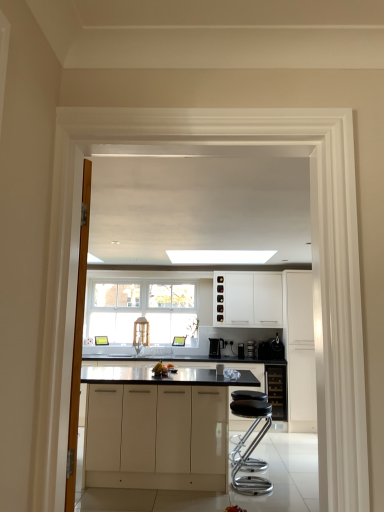
The height and width of the screenshot is (512, 384). Describe the element at coordinates (277, 390) in the screenshot. I see `black glass wine cabinet at center, which is counted as the 3th cabinetry, starting from the left` at that location.

This screenshot has width=384, height=512. What are the coordinates of `metallic silver coffee machine at center, the second appliance in the right-to-left sequence` in the screenshot? It's located at (265, 350).

Image resolution: width=384 pixels, height=512 pixels. Find the location of `white matte cabinet at center, marked as the 2th cabinetry in a left-to-right arrangement`. white matte cabinet at center, marked as the 2th cabinetry in a left-to-right arrangement is located at coordinates (247, 298).

The height and width of the screenshot is (512, 384). In order to click on black leather stool at lower center in this screenshot , I will do `click(250, 448)`.

How much space does white matte cabinetry at center, which is the 4th cabinetry from back to front, occupy vertically?

white matte cabinetry at center, which is the 4th cabinetry from back to front, is 36.18 inches in height.

Identify the location of black glass wine cabinet at center, the second cabinetry in the back-to-front sequence. (277, 390).

Between white matte cabinet at center, arranged as the third cabinetry when viewed from the right, and satin silver toaster at center, placed as the third appliance when sorted from right to left, which one appears on the left side from the viewer's perspective?

Positioned to the left is white matte cabinet at center, arranged as the third cabinetry when viewed from the right.

From a real-world perspective, is white matte cabinet at center, the fourth cabinetry positioned from the front, on top of satin silver toaster at center, placed as the third appliance when sorted from right to left?

Yes, from a real-world perspective, white matte cabinet at center, the fourth cabinetry positioned from the front, is on top of satin silver toaster at center, placed as the third appliance when sorted from right to left.

Which object is thinner, white matte cabinet at center, arranged as the third cabinetry when viewed from the right, or satin silver toaster at center, arranged as the 1th appliance when viewed from the left?

satin silver toaster at center, arranged as the 1th appliance when viewed from the left, is thinner.

Can you confirm if white matte cabinet at center, arranged as the third cabinetry when viewed from the right, is taller than satin silver toaster at center, arranged as the 1th appliance when viewed from the left?

Yes, white matte cabinet at center, arranged as the third cabinetry when viewed from the right, is taller than satin silver toaster at center, arranged as the 1th appliance when viewed from the left.

How much distance is there between satin silver toaster at center, arranged as the 1th appliance when viewed from the left, and white matte cabinetry at center, which is the 4th cabinetry from back to front?

satin silver toaster at center, arranged as the 1th appliance when viewed from the left, and white matte cabinetry at center, which is the 4th cabinetry from back to front, are 2.32 meters apart from each other.

Is satin silver toaster at center, arranged as the 1th appliance when viewed from the left, bigger than white matte cabinetry at center, the 1th cabinetry positioned from the left?

Actually, satin silver toaster at center, arranged as the 1th appliance when viewed from the left, might be smaller than white matte cabinetry at center, the 1th cabinetry positioned from the left.

Is satin silver toaster at center, placed as the third appliance when sorted from right to left, positioned behind white matte cabinetry at center, positioned as the 1th cabinetry in front-to-back order?

Yes, it is behind white matte cabinetry at center, positioned as the 1th cabinetry in front-to-back order.

From a real-world perspective, between satin silver toaster at center, arranged as the 1th appliance when viewed from the left, and white matte cabinetry at center, which is the 4th cabinetry from back to front, who is vertically higher?

satin silver toaster at center, arranged as the 1th appliance when viewed from the left, from a real-world perspective.

Which object is thinner, black glass wine cabinet at center, the 3th cabinetry positioned from the front, or satin black coffee machine at center?

satin black coffee machine at center is thinner.

Is black glass wine cabinet at center, which is counted as the 3th cabinetry, starting from the left, oriented towards satin black coffee machine at center?

No, black glass wine cabinet at center, which is counted as the 3th cabinetry, starting from the left, is not aimed at satin black coffee machine at center.

From a real-world perspective, is black glass wine cabinet at center, which is counted as the 3th cabinetry, starting from the left, under satin black coffee machine at center?

Correct, in the physical world, black glass wine cabinet at center, which is counted as the 3th cabinetry, starting from the left, is lower than satin black coffee machine at center.

Is black glass wine cabinet at center, the second cabinetry in the back-to-front sequence, to the right of satin black coffee machine at center from the viewer's perspective?

Correct, you'll find black glass wine cabinet at center, the second cabinetry in the back-to-front sequence, to the right of satin black coffee machine at center.

Is satin black coffee machine at center facing towards black plastic coffee maker at right, which is the first appliance in right-to-left order?

No.

How many degrees apart are the facing directions of satin black coffee machine at center and black plastic coffee maker at right, which is the first appliance in right-to-left order?

satin black coffee machine at center and black plastic coffee maker at right, which is the first appliance in right-to-left order, are facing 5.08 degrees away from each other.

From a real-world perspective, is satin black coffee machine at center positioned over black plastic coffee maker at right, which is the first appliance in right-to-left order, based on gravity?

No, from a real-world perspective, satin black coffee machine at center is not on top of black plastic coffee maker at right, which is the first appliance in right-to-left order.

From the satin black coffee machine at center, count 3rd appliance to the right and point to it. Please provide its 2D coordinates.

[(276, 348)]

Is there a large distance between black glass wine cabinet at center, which is counted as the 3th cabinetry, starting from the left, and black plastic coffee maker at right, which is the first appliance in right-to-left order?

That's not correct — black glass wine cabinet at center, which is counted as the 3th cabinetry, starting from the left, is a little close to black plastic coffee maker at right, which is the first appliance in right-to-left order.

Can you tell me how much black glass wine cabinet at center, the second cabinetry in the back-to-front sequence, and black plastic coffee maker at right, marked as the third appliance in a left-to-right arrangement, differ in facing direction?

The angular difference between black glass wine cabinet at center, the second cabinetry in the back-to-front sequence, and black plastic coffee maker at right, marked as the third appliance in a left-to-right arrangement, is 2.79 degrees.

From a real-world perspective, which object stands above the other?

black plastic coffee maker at right, which is the first appliance in right-to-left order, is physically above.

Does black glass wine cabinet at center, which is counted as the 3th cabinetry, starting from the left, turn towards black plastic coffee maker at right, marked as the third appliance in a left-to-right arrangement?

No, black glass wine cabinet at center, which is counted as the 3th cabinetry, starting from the left, is not oriented towards black plastic coffee maker at right, marked as the third appliance in a left-to-right arrangement.

Does black plastic coffee maker at right, which is the first appliance in right-to-left order, turn towards white matte cabinet at center, the 1th cabinetry viewed from the back?

No, black plastic coffee maker at right, which is the first appliance in right-to-left order, is not turned towards white matte cabinet at center, the 1th cabinetry viewed from the back.

Is the surface of black plastic coffee maker at right, marked as the third appliance in a left-to-right arrangement, in direct contact with white matte cabinet at center, the fourth cabinetry positioned from the front?

black plastic coffee maker at right, marked as the third appliance in a left-to-right arrangement, and white matte cabinet at center, the fourth cabinetry positioned from the front, are not in contact.

Can you confirm if black plastic coffee maker at right, marked as the third appliance in a left-to-right arrangement, is bigger than white matte cabinet at center, the 1th cabinetry viewed from the back?

No.

Is black plastic coffee maker at right, which is the first appliance in right-to-left order, thinner than white matte cabinet at center, arranged as the third cabinetry when viewed from the right?

Incorrect, the width of black plastic coffee maker at right, which is the first appliance in right-to-left order, is not less than that of white matte cabinet at center, arranged as the third cabinetry when viewed from the right.

From the image's perspective, does black plastic coffee maker at right, marked as the third appliance in a left-to-right arrangement, appear higher than white matte cabinetry at center, which is the 4th cabinetry from back to front?

Yes, from the image's perspective, black plastic coffee maker at right, marked as the third appliance in a left-to-right arrangement, is above white matte cabinetry at center, which is the 4th cabinetry from back to front.

Between black plastic coffee maker at right, which is the first appliance in right-to-left order, and white matte cabinetry at center, the 1th cabinetry positioned from the left, which one has more height?

white matte cabinetry at center, the 1th cabinetry positioned from the left.

How far apart are black plastic coffee maker at right, marked as the third appliance in a left-to-right arrangement, and white matte cabinetry at center, which is the 4th cabinetry from back to front?

2.38 meters.

From the image's perspective, starting from the satin silver toaster at center, placed as the third appliance when sorted from right to left, which cabinetry is the 2nd one above? Please provide its 2D coordinates.

[(247, 298)]

Where is `the 3rd appliance behind when counting from the white matte cabinetry at center, which is the 4th cabinetry from back to front`? Image resolution: width=384 pixels, height=512 pixels. the 3rd appliance behind when counting from the white matte cabinetry at center, which is the 4th cabinetry from back to front is located at coordinates (251, 348).

From the image, which object appears to be nearer to satin black coffee machine at center, black glass wine cabinet at center, the second cabinetry in the back-to-front sequence, or black plastic coffee maker at right, marked as the third appliance in a left-to-right arrangement?

black plastic coffee maker at right, marked as the third appliance in a left-to-right arrangement, is positioned closer to the anchor satin black coffee machine at center.

Looking at the image, which one is located further to white matte cabinet at right, which is the 1th cabinetry in right-to-left order, black leather stool at lower center or metallic silver coffee machine at center, the second appliance in the right-to-left sequence?

Among the two, black leather stool at lower center is located further to white matte cabinet at right, which is the 1th cabinetry in right-to-left order.

Looking at the image, which one is located further to satin black coffee machine at center, black leather stool at lower center or white matte cabinet at center, marked as the 2th cabinetry in a left-to-right arrangement?

Based on the image, black leather stool at lower center appears to be further to satin black coffee machine at center.

Looking at the image, which one is located closer to black leather stool at lower center, black glass wine cabinet at center, the 3th cabinetry positioned from the front, or white matte cabinetry at center, the 1th cabinetry positioned from the left?

white matte cabinetry at center, the 1th cabinetry positioned from the left, is positioned closer to the anchor black leather stool at lower center.

Looking at the image, which one is located closer to black glass wine cabinet at center, the 3th cabinetry positioned from the front, black leather stool at lower center or metallic silver coffee machine at center, which ranks as the 2th appliance in left-to-right order?

The object closer to black glass wine cabinet at center, the 3th cabinetry positioned from the front, is metallic silver coffee machine at center, which ranks as the 2th appliance in left-to-right order.

Estimate the real-world distances between objects in this image. Which object is further from satin black coffee machine at center, white matte cabinet at right, placed as the 4th cabinetry when sorted from left to right, or black leather stool at lower center?

black leather stool at lower center is further to satin black coffee machine at center.

From the image, which object appears to be nearer to black leather stool at lower center, metallic silver coffee machine at center, which ranks as the 2th appliance in left-to-right order, or satin silver toaster at center, arranged as the 1th appliance when viewed from the left?

Among the two, metallic silver coffee machine at center, which ranks as the 2th appliance in left-to-right order, is located nearer to black leather stool at lower center.

Based on their spatial positions, is metallic silver coffee machine at center, which ranks as the 2th appliance in left-to-right order, or white matte cabinet at center, marked as the 2th cabinetry in a left-to-right arrangement, further from white matte cabinetry at center, the 1th cabinetry positioned from the left?

white matte cabinet at center, marked as the 2th cabinetry in a left-to-right arrangement, is positioned further to the anchor white matte cabinetry at center, the 1th cabinetry positioned from the left.

What are the coordinates of `coffee machine that lies between white matte cabinet at center, the 1th cabinetry viewed from the back, and metallic silver coffee machine at center, which ranks as the 2th appliance in left-to-right order, from top to bottom` in the screenshot? It's located at (216, 347).

At what (x,y) coordinates should I click in order to perform the action: click on appliance between black leather stool at lower center and metallic silver coffee machine at center, which ranks as the 2th appliance in left-to-right order, from front to back. Please return your answer as a coordinate pair (x, y). This screenshot has height=512, width=384. Looking at the image, I should click on (276, 348).

Find the location of a particular element. This screenshot has height=512, width=384. appliance that lies between white matte cabinet at center, marked as the 2th cabinetry in a left-to-right arrangement, and metallic silver coffee machine at center, which ranks as the 2th appliance in left-to-right order, from top to bottom is located at coordinates (276, 348).

The height and width of the screenshot is (512, 384). I want to click on appliance between white matte cabinetry at center, positioned as the 1th cabinetry in front-to-back order, and metallic silver coffee machine at center, which ranks as the 2th appliance in left-to-right order, in the front-back direction, so coord(276,348).